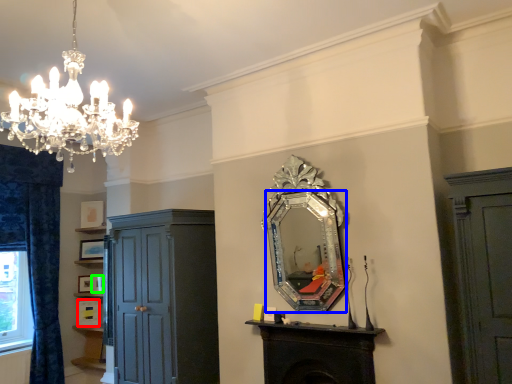
Question: Which is farther away from picture frame (highlighted by a red box)? mirror (highlighted by a blue box) or picture frame (highlighted by a green box)?

Choices:
 (A) mirror
 (B) picture frame

Answer: (A)